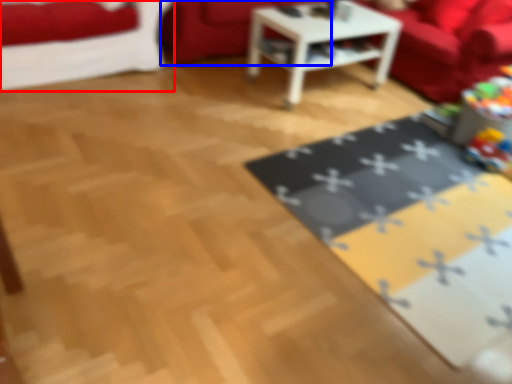
Question: Which of the following is the farthest to the observer, studio couch (highlighted by a red box) or couch (highlighted by a blue box)?

Choices:
 (A) studio couch
 (B) couch

Answer: (B)